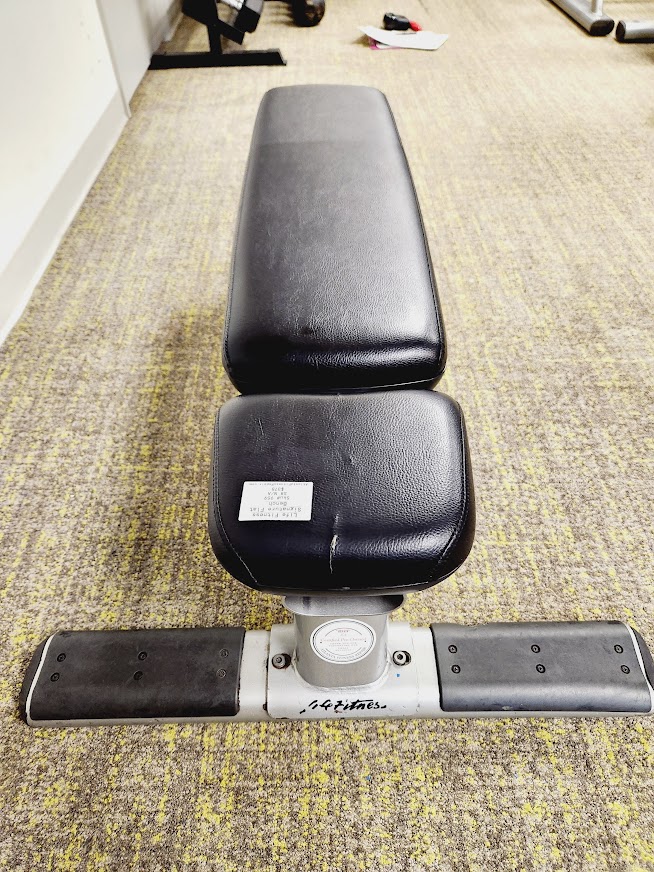
In order to click on rear cushion in this screenshot , I will do `click(328, 236)`.